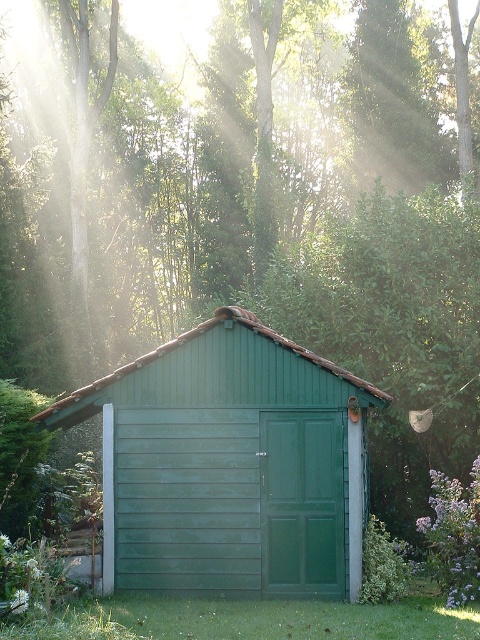
Between green wood/glass garage door at center and green wooden door at center, which one is positioned lower?

green wooden door at center is below.

Does green wood/glass garage door at center come behind green wooden door at center?

Yes, it is behind green wooden door at center.

Does point (178, 490) come behind point (265, 481)?

No, (178, 490) is in front of (265, 481).

The image size is (480, 640). I want to click on green wood/glass garage door at center, so click(229, 500).

Which is more to the right, green woodshed at center or green wood/glass garage door at center?

From the viewer's perspective, green wood/glass garage door at center appears more on the right side.

Is green woodshed at center taller than green wood/glass garage door at center?

Indeed, green woodshed at center has a greater height compared to green wood/glass garage door at center.

Measure the distance between point (183, 497) and camera.

Point (183, 497) is 10.57 meters away from camera.

Where is `green woodshed at center`? This screenshot has height=640, width=480. green woodshed at center is located at coordinates (229, 465).

From the picture: Is green woodshed at center to the left of green wooden door at center from the viewer's perspective?

Indeed, green woodshed at center is positioned on the left side of green wooden door at center.

The height and width of the screenshot is (640, 480). What do you see at coordinates (229, 465) in the screenshot?
I see `green woodshed at center` at bounding box center [229, 465].

The width and height of the screenshot is (480, 640). In order to click on green woodshed at center in this screenshot , I will do `click(229, 465)`.